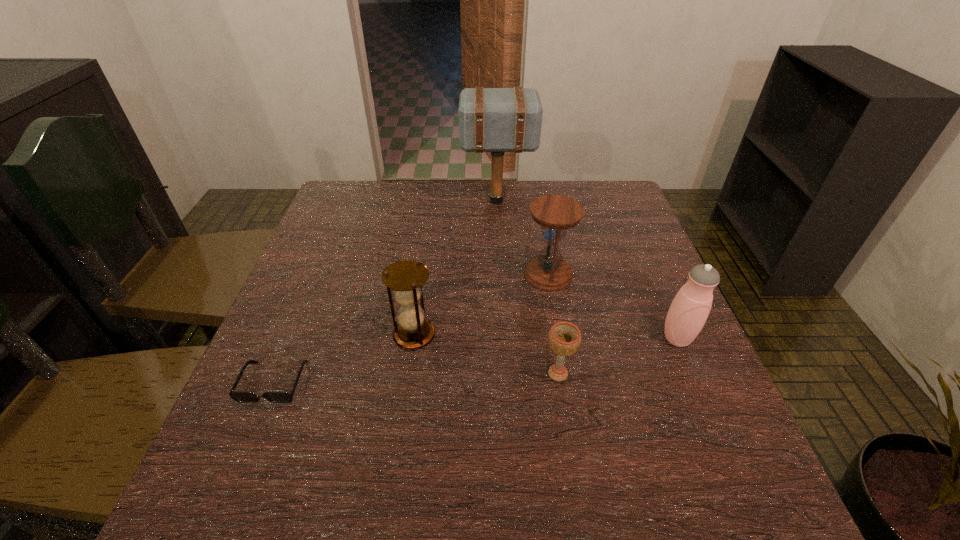
You are a GUI agent. You are given a task and a screenshot of the screen. Output one action in this format:
    pyautogui.click(x=<x>, y=<y>)
    Task: Click on the object present at the right edge
    Image resolution: width=960 pixels, height=540 pixels.
    Given the screenshot: What is the action you would take?
    pyautogui.click(x=689, y=310)

Locate an element on the screen. This screenshot has height=540, width=960. vacant region at the far edge of the desktop is located at coordinates (480, 180).

In the image, there is a desktop. At what (x,y) coordinates should I click in order to perform the action: click on vacant space at the near edge. Please return your answer as a coordinate pair (x, y). The height and width of the screenshot is (540, 960). Looking at the image, I should click on (609, 475).

What are the coordinates of `vacant space at the left edge` in the screenshot? It's located at (308, 360).

Locate an element on the screen. This screenshot has width=960, height=540. free space at the right edge of the desktop is located at coordinates (625, 227).

Identify the location of vacant area at the far left corner of the desktop. The height and width of the screenshot is (540, 960). (373, 224).

Image resolution: width=960 pixels, height=540 pixels. In the image, there is a desktop. What are the coordinates of `vacant space at the near left corner` in the screenshot? It's located at (204, 490).

The height and width of the screenshot is (540, 960). Identify the location of free space at the far right corner. (590, 199).

Locate an element on the screen. free space between the farthest object and the shortest object is located at coordinates (386, 292).

You are a GUI agent. You are given a task and a screenshot of the screen. Output one action in this format:
    pyautogui.click(x=<x>, y=<y>)
    Task: Click on the free spot between the fifth tallest object and the leftmost object
    The width and height of the screenshot is (960, 540).
    Given the screenshot: What is the action you would take?
    pyautogui.click(x=416, y=378)